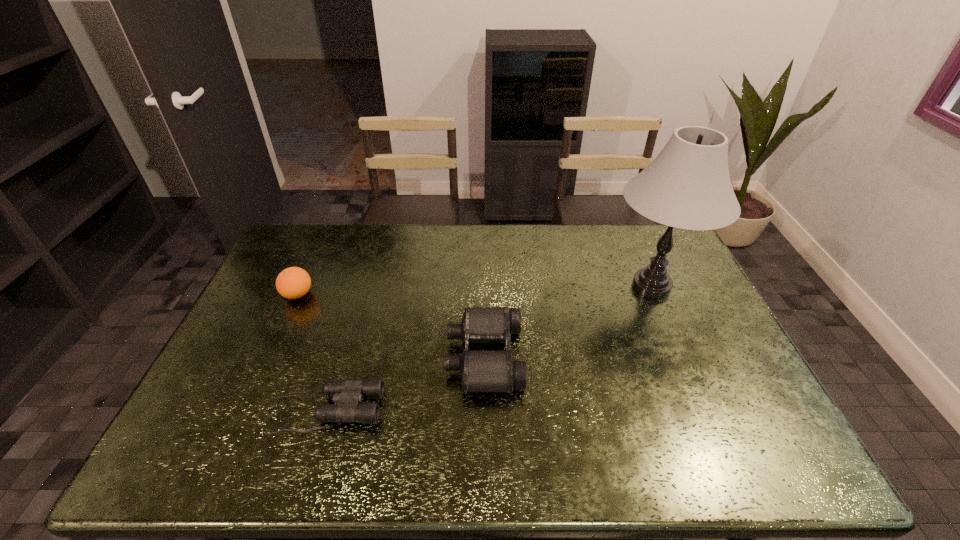
This screenshot has width=960, height=540. I want to click on free space at the right edge of the desktop, so click(708, 415).

Image resolution: width=960 pixels, height=540 pixels. In order to click on free space at the far left corner in this screenshot , I will do `click(310, 237)`.

Image resolution: width=960 pixels, height=540 pixels. In order to click on empty space between the left binoculars and the tallest object in this screenshot , I will do `click(488, 348)`.

You are a GUI agent. You are given a task and a screenshot of the screen. Output one action in this format:
    pyautogui.click(x=<x>, y=<y>)
    Task: Click on the vacant area between the third object from right to left and the orange
    The width and height of the screenshot is (960, 540).
    Given the screenshot: What is the action you would take?
    pyautogui.click(x=311, y=352)

Identify the location of empty location between the taller binoculars and the leftmost object. This screenshot has width=960, height=540. (391, 326).

Locate an element on the screen. vacant region between the rightmost object and the leftmost object is located at coordinates (474, 291).

The width and height of the screenshot is (960, 540). Identify the location of empty space that is in between the taller binoculars and the orange. (391, 326).

Locate an element on the screen. This screenshot has width=960, height=540. free point between the lamp and the left binoculars is located at coordinates (488, 348).

In order to click on free spot between the right binoculars and the second object from left to right in this screenshot , I will do `click(404, 383)`.

At what (x,y) coordinates should I click in order to perform the action: click on free spot between the left binoculars and the right binoculars. Please return your answer as a coordinate pair (x, y). The width and height of the screenshot is (960, 540). Looking at the image, I should click on (404, 383).